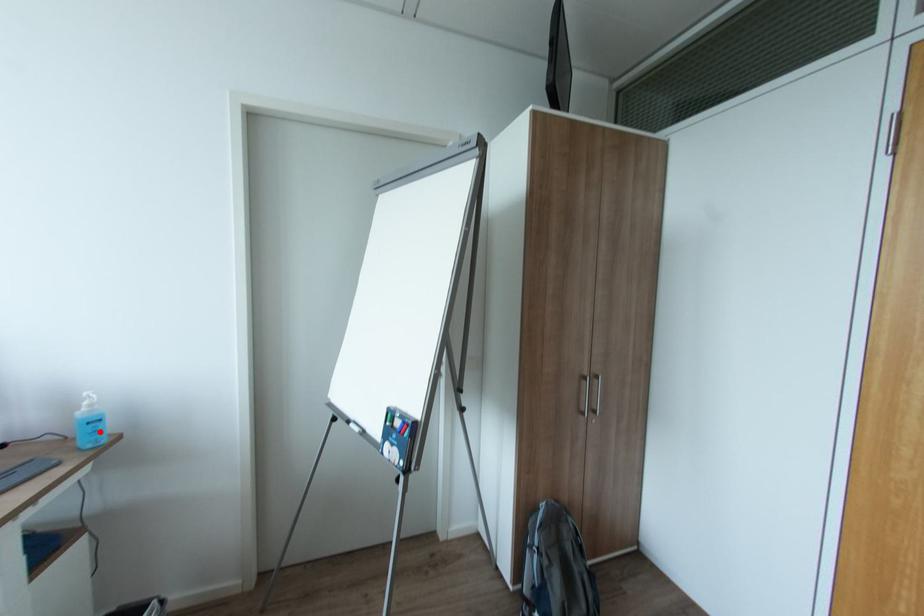
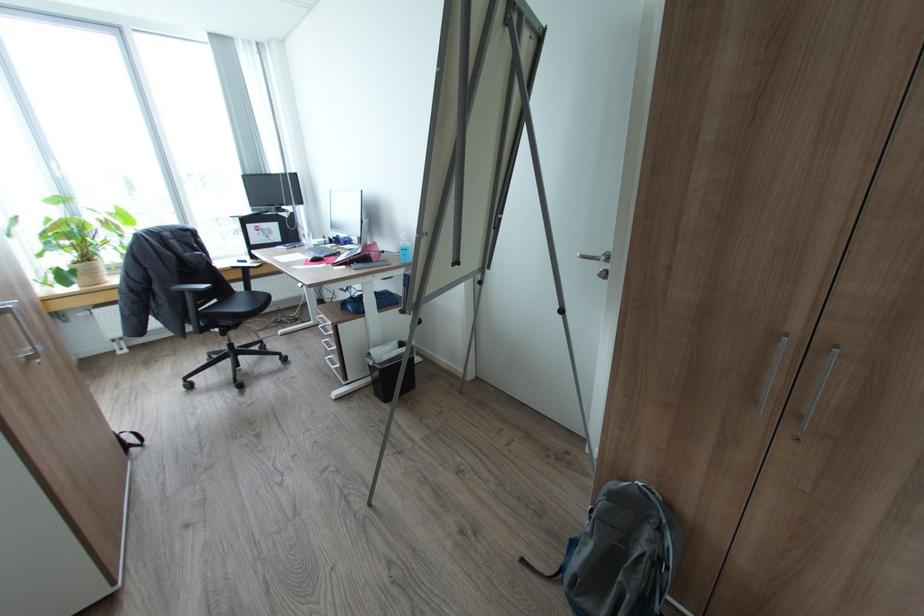
Locate, in the second image, the point that corresponds to the highlighted location in the first image.

(408, 254)